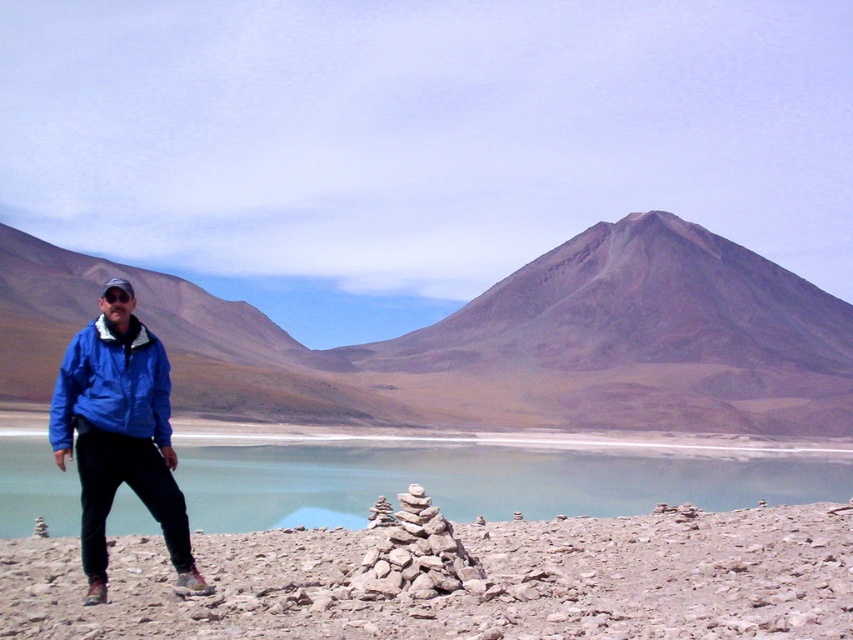
Looking at this image, does blue fabric jacket at lower left have a lesser width compared to blue fabric jacket at left?

No, blue fabric jacket at lower left is not thinner than blue fabric jacket at left.

Can you confirm if blue fabric jacket at lower left is positioned below blue fabric jacket at left?

Indeed, blue fabric jacket at lower left is positioned under blue fabric jacket at left.

Is point (83, 388) farther from camera compared to point (64, 404)?

Yes, point (83, 388) is behind point (64, 404).

The image size is (853, 640). Identify the location of blue fabric jacket at lower left. (119, 433).

Who is positioned more to the right, brown/dry soil mountain at center or greenish-blue water at center?

Positioned to the right is greenish-blue water at center.

What do you see at coordinates (492, 340) in the screenshot? I see `brown/dry soil mountain at center` at bounding box center [492, 340].

Identify the location of brown/dry soil mountain at center. (492, 340).

Can you confirm if greenish-blue water at center is positioned to the left of blue fabric jacket at lower left?

In fact, greenish-blue water at center is to the right of blue fabric jacket at lower left.

Can you confirm if greenish-blue water at center is wider than blue fabric jacket at lower left?

Correct, the width of greenish-blue water at center exceeds that of blue fabric jacket at lower left.

Which is behind, point (550, 490) or point (167, 547)?

The point (550, 490) is behind.

Locate an element on the screen. greenish-blue water at center is located at coordinates (480, 483).